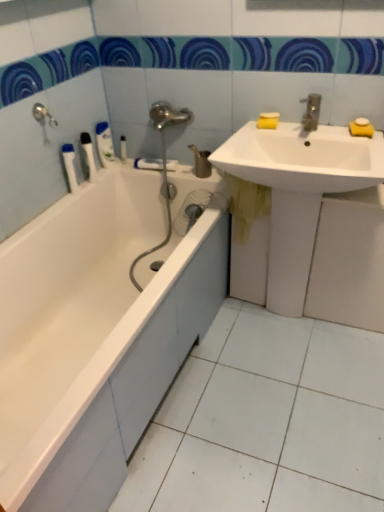
Identify the location of free space that is in between metallic silver towel bar at center and white plastic toilet brush at upper left, positioned as the 3th toiletry in left-to-right order. The height and width of the screenshot is (512, 384). (139, 168).